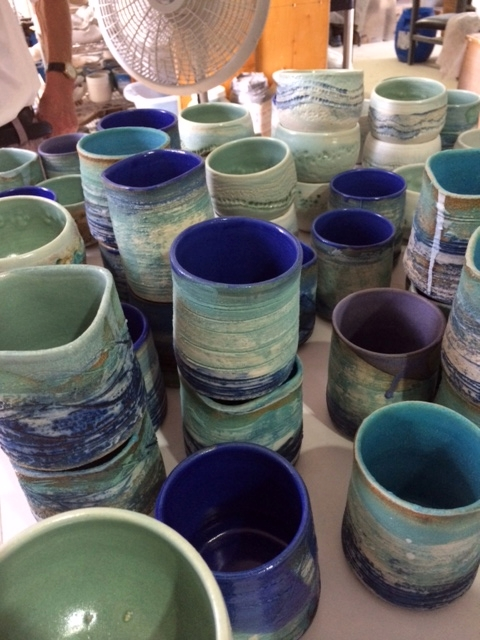
The width and height of the screenshot is (480, 640). Find the location of `tabletop`. tabletop is located at coordinates (314, 428).